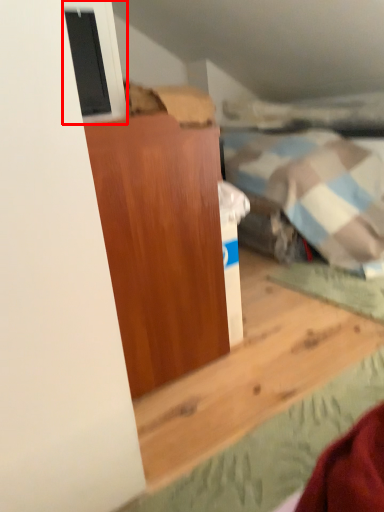
Question: From the image's perspective, what is the correct spatial positioning of window (annotated by the red box) in reference to furniture?

Choices:
 (A) below
 (B) above

Answer: (B)